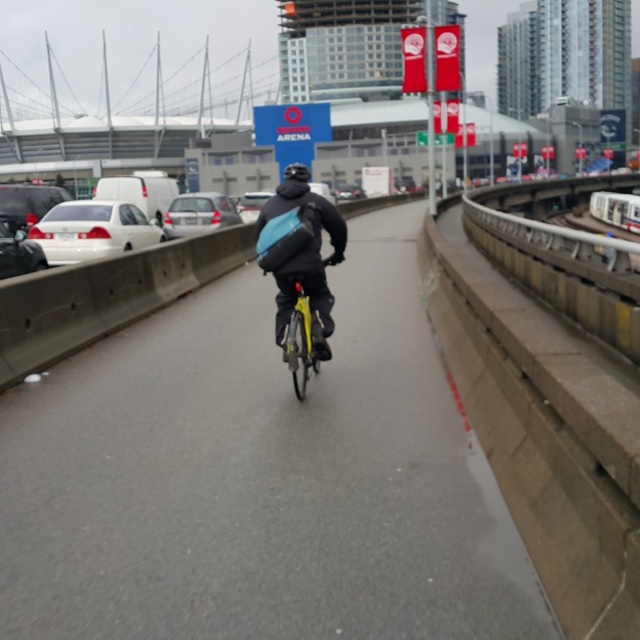
You are a pedestrian on the sidewalk and see the matte black jacket at center and the silver metallic sedan at center in the middle of the road. Which object is closer to your left side?

The silver metallic sedan at center is closer to your left side because the matte black jacket at center is positioned on the right side of it.

You are a driver in a white matte sedan at left. You want to make a U turn but need to check if there is enough space between your car and the yellow matte bicycle at center. Can you make the U turn safely?

The yellow matte bicycle at center is behind the white matte sedan at left, so there is sufficient space between them to safely make a U turn.